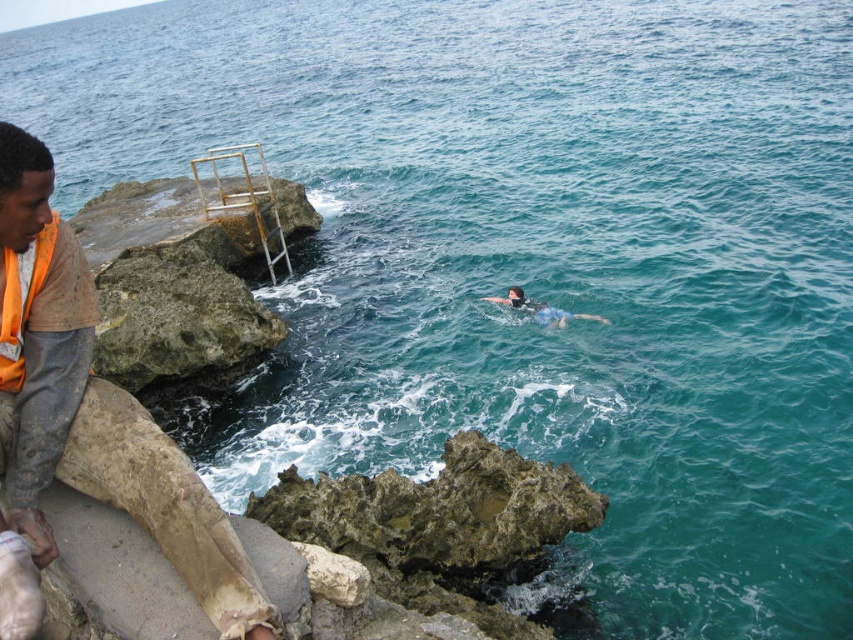
You are a lifeguard on duty and notice two objects in the water. One is an orange fabric shirt at left and the other is a blue rubber at center. Which object is closer to the bottom of the ocean?

The orange fabric shirt at left is positioned under blue rubber at center, so it is closer to the bottom of the ocean.

You are a lifeguard on duty and notice two flotation devices in the water. The orange fabric life jacket at left and the blue rubber at center. Which one is higher above the water surface?

The orange fabric life jacket at left is taller than the blue rubber at center, so it is higher above the water surface.

You are a lifeguard on duty and need to quickly assess the situation. You see an orange fabric shirt at left and a blue rubber at center. Which object is wider?

The blue rubber at center is wider than the orange fabric shirt at left.